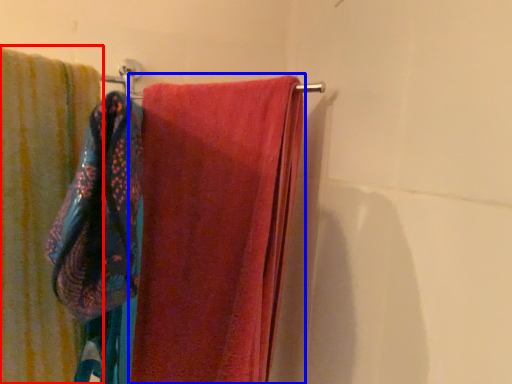
Question: Which of the following is the closest to the observer, towel (highlighted by a red box) or towel (highlighted by a blue box)?

Choices:
 (A) towel
 (B) towel

Answer: (A)